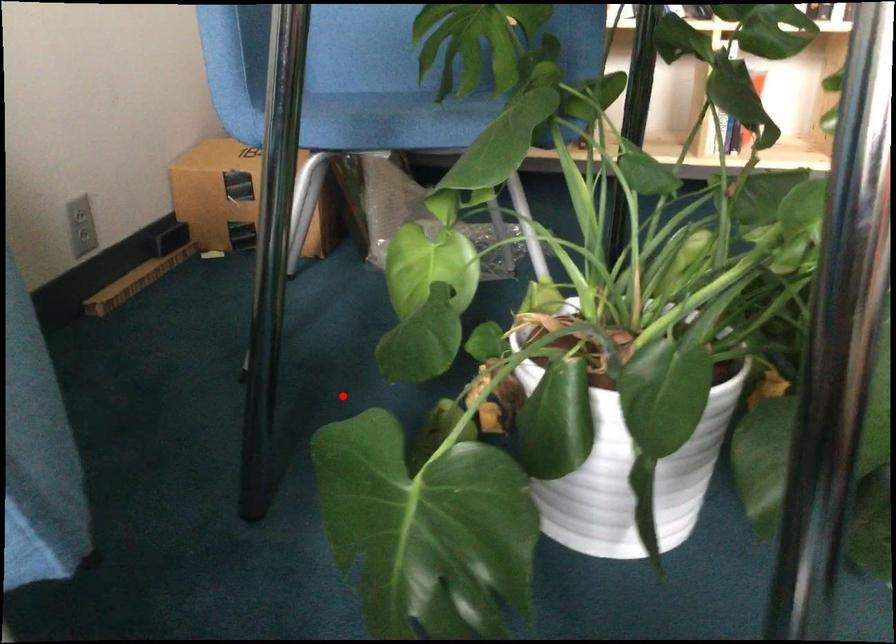
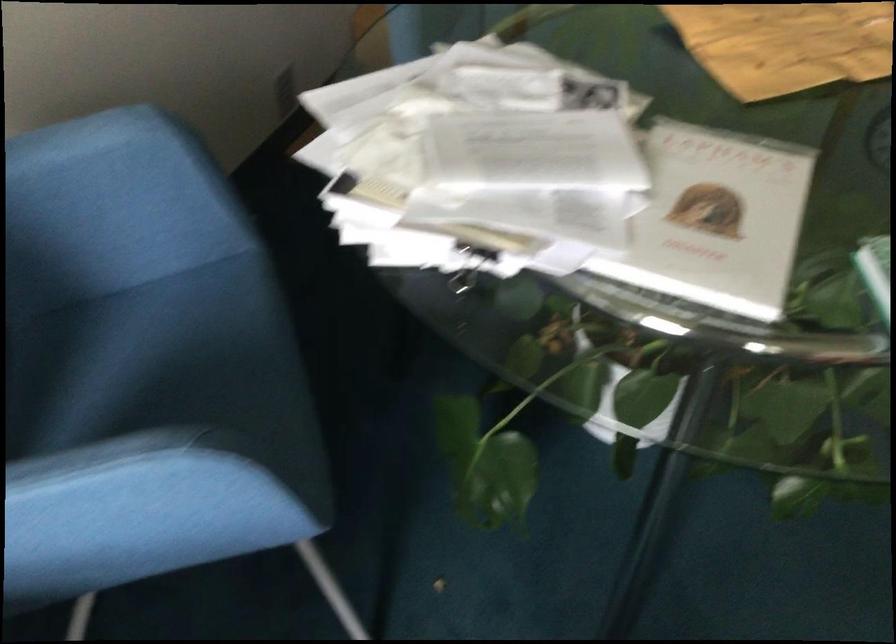
Question: I am providing you with two images of the same scene from different viewpoints. A red point is marked on the first image. At the location where the point appears in image 1, is it still visible in image 2?

Choices:
 (A) Yes
 (B) No

Answer: (A)